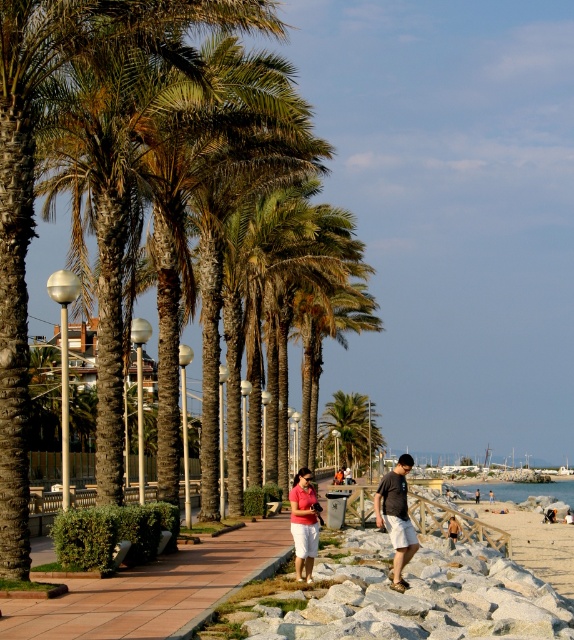
Based on the scene description, where is the green leafy palm tree at center located in the image?

The green leafy palm tree at center is located at point (350,426).

From the picture: You are a photographer trying to capture the two people in the scene. The matte pink shirt at center and the beige fabric shorts at center are part of the same person. Which clothing item is higher up on their body?

The matte pink shirt at center is taller than beige fabric shorts at center, so the shirt is higher up on their body.